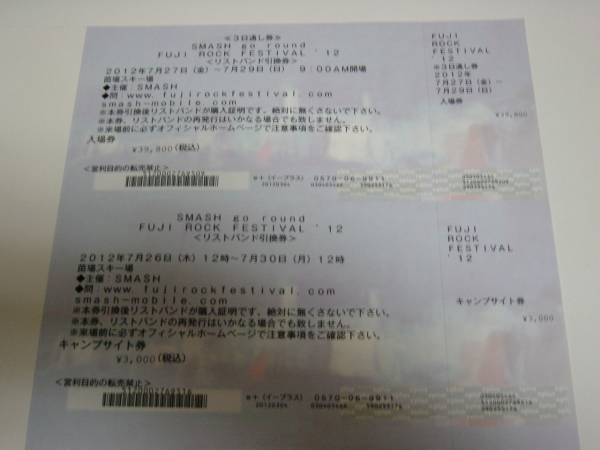
Identify the location of corners. The height and width of the screenshot is (450, 600). tap(86, 24), tap(518, 22).